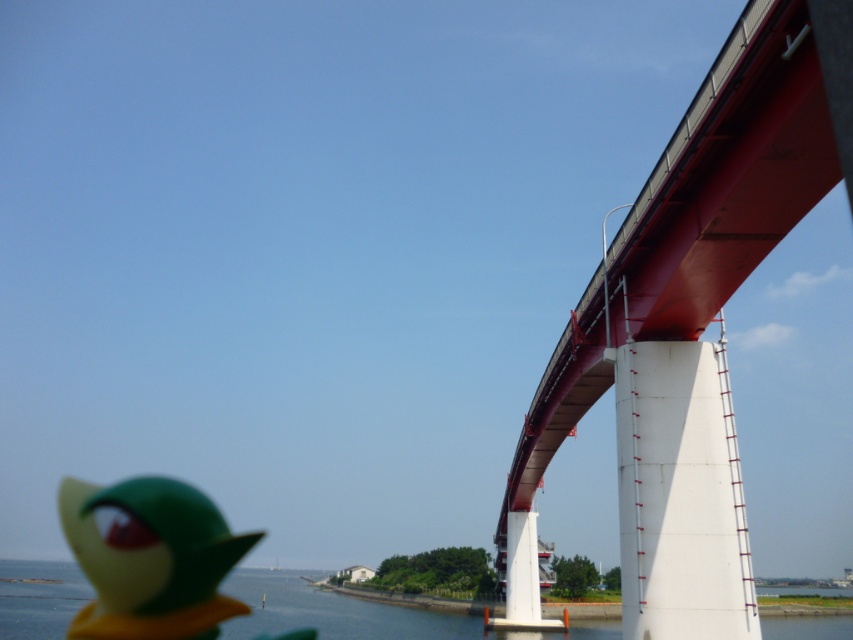
Based on the photo, you are standing on the ground looking at the scene. Which object, the red painted steel bridge at right or the blue water at lower left, is closer to you?

The red painted steel bridge at right is closer to you because it is in front of the blue water at lower left.

You are a photographer trying to capture a photo of the red painted steel bridge at right and the matte green rubber duck at lower left. Which object should you focus on first if you want to include both in your frame without moving the camera?

The red painted steel bridge at right is positioned on the right side of matte green rubber duck at lower left, so you should focus on the matte green rubber duck at lower left first to ensure both are in frame.

You are a photographer trying to capture the entire scene of the large red bridge and its surroundings. However, your camera frame is limited in size. Given that the matte green rubber duck at lower left and the blue water at lower left are both in the lower left corner, which one will you need to adjust your camera angle to include more of?

Since the matte green rubber duck at lower left occupies less space than the blue water at lower left, you will need to adjust your camera angle to include more of the blue water at lower left because it takes up more space in the lower left corner.